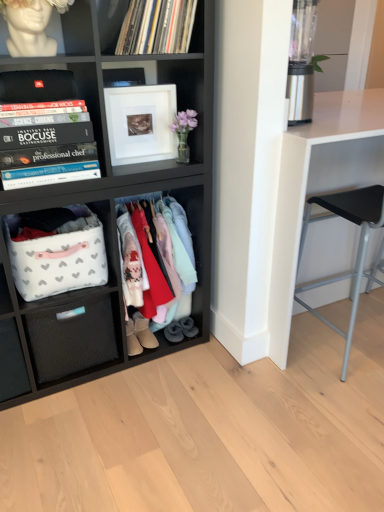
Question: Is white fabric basket at lower left turned away from black woven drawer at lower left?

Choices:
 (A) yes
 (B) no

Answer: (B)

Question: Are white fabric basket at lower left and black woven drawer at lower left far apart?

Choices:
 (A) no
 (B) yes

Answer: (A)

Question: Could you tell me if white fabric basket at lower left is turned towards black woven drawer at lower left?

Choices:
 (A) yes
 (B) no

Answer: (B)

Question: Does white fabric basket at lower left have a greater height compared to black woven drawer at lower left?

Choices:
 (A) no
 (B) yes

Answer: (A)

Question: Can you confirm if white fabric basket at lower left is smaller than black woven drawer at lower left?

Choices:
 (A) no
 (B) yes

Answer: (B)

Question: In terms of height, does pastel cotton clothes at center look taller or shorter compared to matte black storage unit at center, the first shelf in the bottom-to-top sequence?

Choices:
 (A) short
 (B) tall

Answer: (A)

Question: Is point (155, 327) closer or farther from the camera than point (117, 309)?

Choices:
 (A) farther
 (B) closer

Answer: (A)

Question: Is pastel cotton clothes at center in front of or behind matte black storage unit at center, the first shelf in the bottom-to-top sequence, in the image?

Choices:
 (A) front
 (B) behind

Answer: (B)

Question: In the image, is pastel cotton clothes at center on the left side or the right side of matte black storage unit at center, the first shelf in the bottom-to-top sequence?

Choices:
 (A) left
 (B) right

Answer: (B)

Question: Is black hardcover books at left, positioned as the 2th shelf in bottom-to-top order, bigger or smaller than gray suede boot at lower center, which is the first footwear in right-to-left order?

Choices:
 (A) big
 (B) small

Answer: (A)

Question: Is black hardcover books at left, positioned as the 2th shelf in bottom-to-top order, spatially inside gray suede boot at lower center, the third footwear from the left, or outside of it?

Choices:
 (A) outside
 (B) inside

Answer: (A)

Question: From a real-world perspective, is black hardcover books at left, positioned as the 2th shelf in bottom-to-top order, physically located above or below gray suede boot at lower center, the third footwear from the left?

Choices:
 (A) above
 (B) below

Answer: (A)

Question: From the image's perspective, is black hardcover books at left, positioned as the 2th shelf in bottom-to-top order, positioned above or below gray suede boot at lower center, the third footwear from the left?

Choices:
 (A) above
 (B) below

Answer: (A)

Question: Considering their positions, is white fabric basket at lower left located in front of or behind black woven drawer at lower left?

Choices:
 (A) front
 (B) behind

Answer: (A)

Question: From their relative heights in the image, would you say white fabric basket at lower left is taller or shorter than black woven drawer at lower left?

Choices:
 (A) tall
 (B) short

Answer: (B)